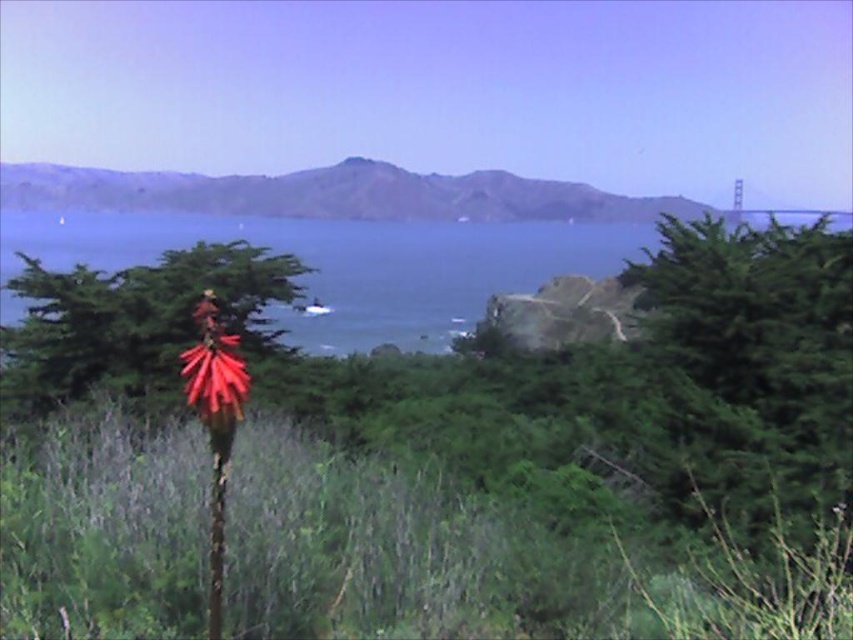
Question: Estimate the real-world distances between objects in this image. Which object is closer to the green grassy hillside at upper center?

Choices:
 (A) green textured tree at right
 (B) red matte flower at center
 (C) bright red spiky flower at center

Answer: (A)

Question: Is blue water at center thinner than green grassy hillside at upper center?

Choices:
 (A) no
 (B) yes

Answer: (A)

Question: Which of the following is the farthest from the observer?

Choices:
 (A) (16, 278)
 (B) (415, 186)

Answer: (B)

Question: Which of the following is the farthest from the observer?

Choices:
 (A) (694, 371)
 (B) (202, 410)

Answer: (A)

Question: Is green textured tree at right behind red matte flower at center?

Choices:
 (A) yes
 (B) no

Answer: (B)

Question: Can you confirm if green textured tree at right is bigger than bright red spiky flower at center?

Choices:
 (A) no
 (B) yes

Answer: (B)